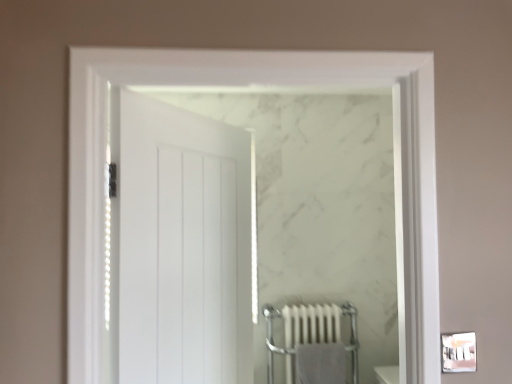
Question: Would you say white metallic radiator at lower center is outside gray cotton bath towel at lower center?

Choices:
 (A) no
 (B) yes

Answer: (B)

Question: Is gray cotton bath towel at lower center a part of white metallic radiator at lower center?

Choices:
 (A) no
 (B) yes

Answer: (B)

Question: Is white metallic radiator at lower center taller than gray cotton bath towel at lower center?

Choices:
 (A) no
 (B) yes

Answer: (B)

Question: Is white metallic radiator at lower center at the right side of gray cotton bath towel at lower center?

Choices:
 (A) no
 (B) yes

Answer: (A)

Question: From the image's perspective, is white metallic radiator at lower center below gray cotton bath towel at lower center?

Choices:
 (A) yes
 (B) no

Answer: (B)

Question: Looking at their shapes, would you say white metallic radiator at lower center is wider or thinner than white matte door at center?

Choices:
 (A) wide
 (B) thin

Answer: (A)

Question: Is white metallic radiator at lower center taller or shorter than white matte door at center?

Choices:
 (A) short
 (B) tall

Answer: (A)

Question: In the image, is white metallic radiator at lower center on the left side or the right side of white matte door at center?

Choices:
 (A) right
 (B) left

Answer: (A)

Question: Is white metallic radiator at lower center situated inside white matte door at center or outside?

Choices:
 (A) inside
 (B) outside

Answer: (B)

Question: Considering the positions of white matte door at center and gray cotton bath towel at lower center in the image, is white matte door at center taller or shorter than gray cotton bath towel at lower center?

Choices:
 (A) short
 (B) tall

Answer: (B)

Question: Is white matte door at center in front of or behind gray cotton bath towel at lower center in the image?

Choices:
 (A) behind
 (B) front

Answer: (B)

Question: From a real-world perspective, is white matte door at center physically located above or below gray cotton bath towel at lower center?

Choices:
 (A) below
 (B) above

Answer: (B)

Question: Does point (225, 241) appear closer or farther from the camera than point (330, 375)?

Choices:
 (A) farther
 (B) closer

Answer: (B)

Question: In terms of size, does gray cotton bath towel at lower center appear bigger or smaller than white metallic radiator at lower center?

Choices:
 (A) big
 (B) small

Answer: (B)

Question: Is gray cotton bath towel at lower center inside the boundaries of white metallic radiator at lower center, or outside?

Choices:
 (A) inside
 (B) outside

Answer: (A)